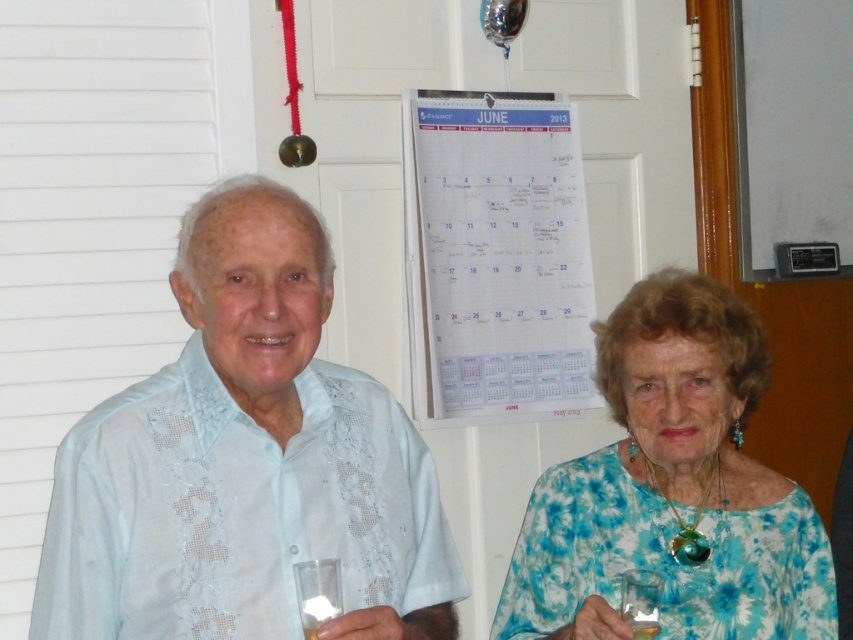
Question: Which point is closer to the camera taking this photo?

Choices:
 (A) (273, 452)
 (B) (659, 630)
 (C) (637, 598)
 (D) (328, 561)

Answer: (D)

Question: Does blue floral dress at center have a greater width compared to clear glass at lower center?

Choices:
 (A) no
 (B) yes

Answer: (B)

Question: Does light blue fabric shirt at center appear over translucent glass at lower center?

Choices:
 (A) no
 (B) yes

Answer: (B)

Question: Is blue floral dress at center above clear plastic wine glass at lower center?

Choices:
 (A) no
 (B) yes

Answer: (B)

Question: Estimate the real-world distances between objects in this image. Which object is closer to the light blue fabric shirt at center?

Choices:
 (A) blue floral dress at center
 (B) clear glass at lower center
 (C) clear plastic wine glass at lower center

Answer: (B)

Question: Which point is closer to the camera?

Choices:
 (A) blue floral dress at center
 (B) translucent glass at lower center
 (C) light blue fabric shirt at center
 (D) clear glass at lower center

Answer: (C)